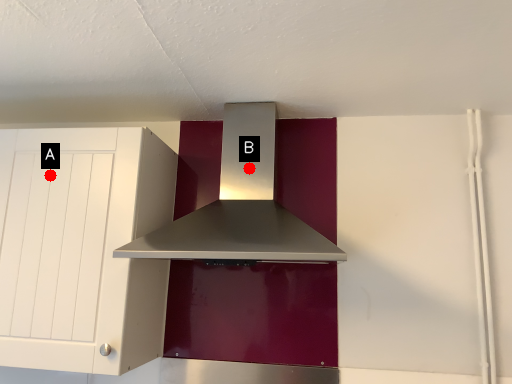
Question: Two points are circled on the image, labeled by A and B beside each circle. Which point is closer to the camera?

Choices:
 (A) A is closer
 (B) B is closer

Answer: (A)